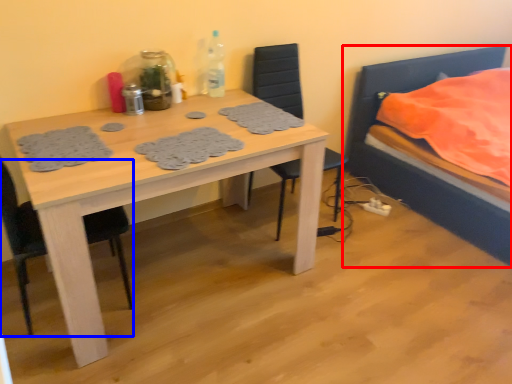
Question: Which of the following is the closest to the observer, bed (highlighted by a red box) or chair (highlighted by a blue box)?

Choices:
 (A) bed
 (B) chair

Answer: (B)